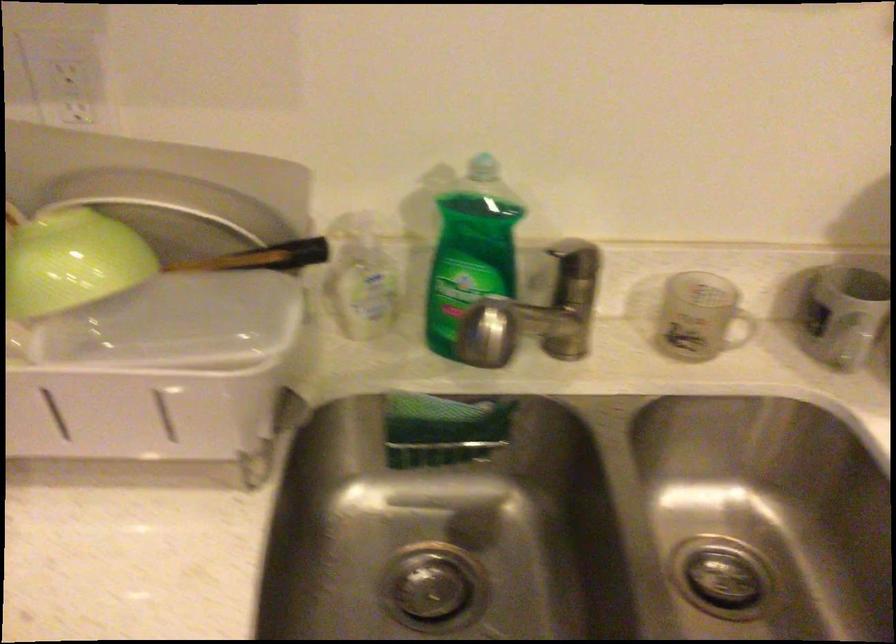
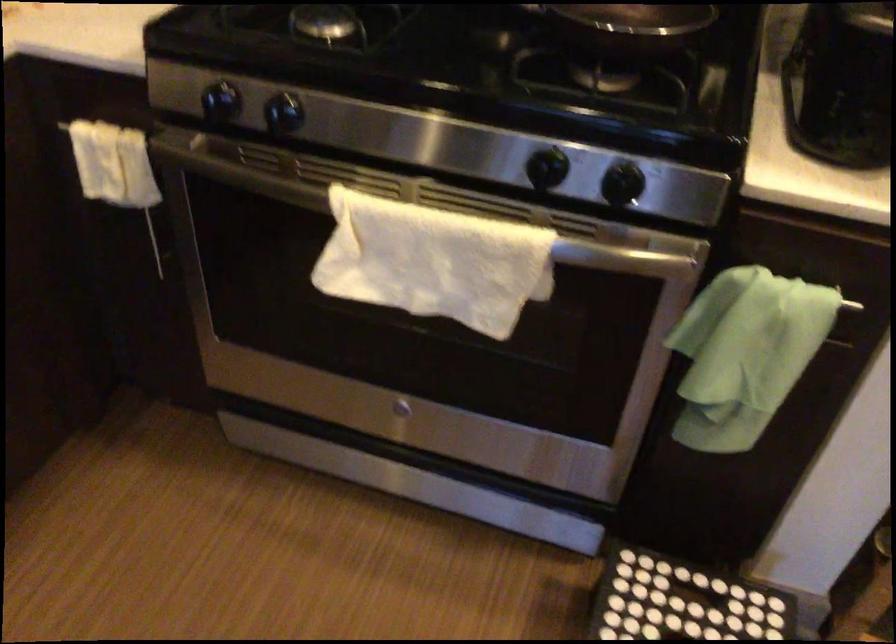
Based on the continuous images, in which direction is the camera rotating?

The camera's rotation is toward right-down.